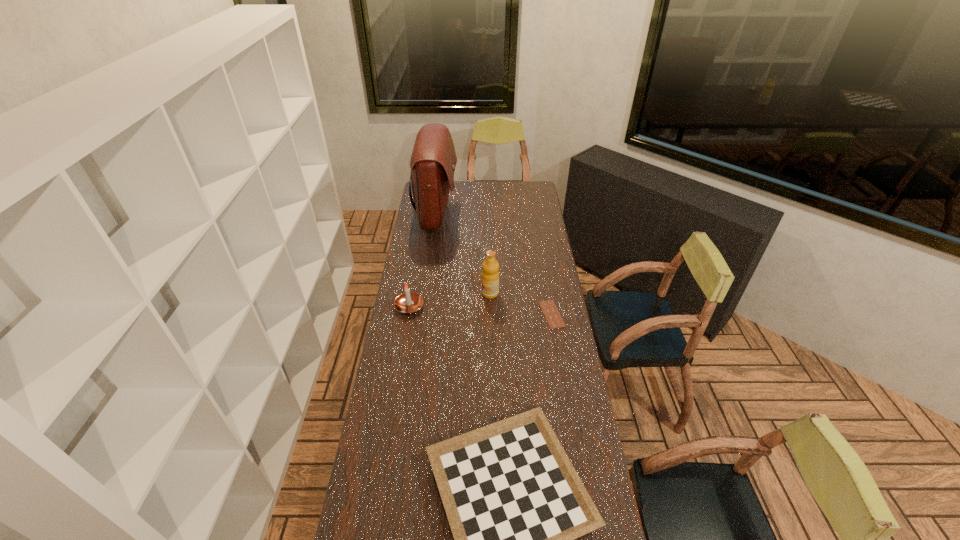
The width and height of the screenshot is (960, 540). I want to click on the farthest object, so click(x=433, y=160).

Identify the location of satchel. (433, 160).

Where is `fruit juice`? This screenshot has width=960, height=540. fruit juice is located at coordinates (490, 275).

Find the location of a particular element. the third shortest object is located at coordinates (408, 302).

You are a GUI agent. You are given a task and a screenshot of the screen. Output one action in this format:
    pyautogui.click(x=<x>, y=<y>)
    Task: Click on the chocolate bar
    Image resolution: width=960 pixels, height=540 pixels.
    Given the screenshot: What is the action you would take?
    pyautogui.click(x=554, y=320)

Where is `vacant area located on the open flap of the tallest object`? This screenshot has height=540, width=960. vacant area located on the open flap of the tallest object is located at coordinates (492, 214).

You are a GUI agent. You are given a task and a screenshot of the screen. Output one action in this format:
    pyautogui.click(x=<x>, y=<y>)
    Task: Click on the free space located 0.120m on the front label of the fruit juice
    
    Given the screenshot: What is the action you would take?
    pyautogui.click(x=456, y=293)

This screenshot has height=540, width=960. What are the coordinates of `vacant point located on the front label of the fruit juice` in the screenshot? It's located at (415, 293).

The width and height of the screenshot is (960, 540). Identify the location of free region located 0.220m on the front label of the fruit juice. (434, 293).

Image resolution: width=960 pixels, height=540 pixels. Find the location of `free space located 0.090m on the back of the third tallest object`. free space located 0.090m on the back of the third tallest object is located at coordinates (413, 284).